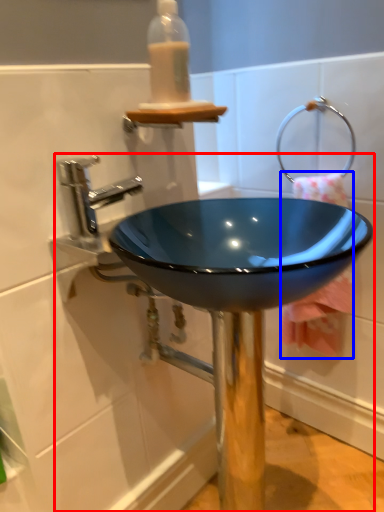
Question: Which point is further to the camera, sink (highlighted by a red box) or bath towel (highlighted by a blue box)?

Choices:
 (A) sink
 (B) bath towel

Answer: (B)